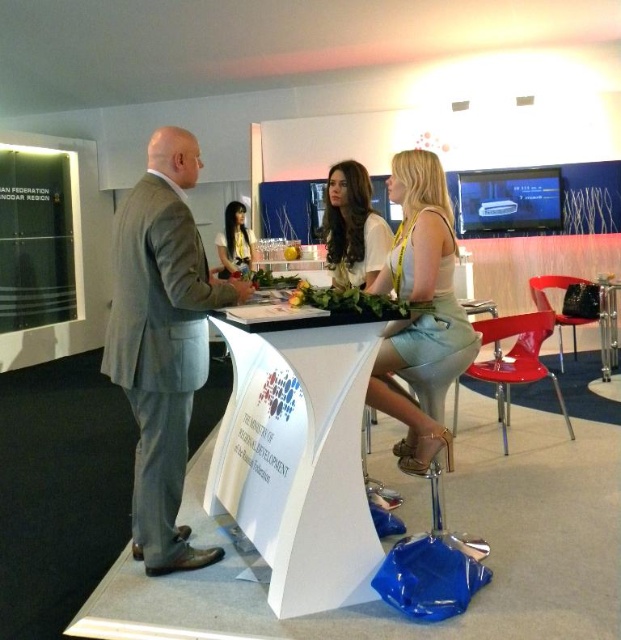
You are a photographer at the event and need to capture a photo of both the light blue fabric dress at center and the white fabric dress at center. Which dress should you focus on first to ensure both are in the frame?

The light blue fabric dress at center is positioned on the right side of white fabric dress at center, so you should focus on the white fabric dress at center first to ensure both are in the frame.

From the picture: You are standing in the exhibition hall and want to determine which of the two points, point (368, 291) or point (335, 232), is nearer to you. Based on the scene description, which point is closer?

Point (368, 291) is closer to the viewer than point (335, 232).

You are a visitor at the exhibition and want to place a brochure on the white glossy table at center without covering the white fabric dress at center. Is the table wide enough to accommodate both the brochure and the dress?

The white glossy table at center is wider than the white fabric dress at center, so yes, the table has enough space to place the brochure alongside the dress without covering it.